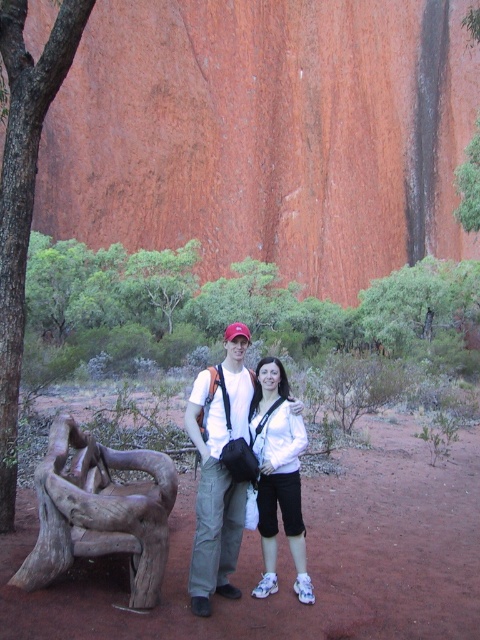
Question: Which is farther from the matte white shirt at center?

Choices:
 (A) smooth bark tree trunk at left
 (B) white matte shirt at center

Answer: (A)

Question: Observing the image, what is the correct spatial positioning of smooth bark tree trunk at left in reference to white matte shirt at center?

Choices:
 (A) below
 (B) above

Answer: (B)

Question: In this image, where is matte white shirt at center located relative to white matte shirt at center?

Choices:
 (A) above
 (B) below

Answer: (A)

Question: Which of the following is the farthest from the observer?

Choices:
 (A) smooth bark tree trunk at left
 (B) white matte shirt at center

Answer: (A)

Question: Is matte white shirt at center further to the viewer compared to white matte shirt at center?

Choices:
 (A) yes
 (B) no

Answer: (B)

Question: Which object is closer to the camera taking this photo?

Choices:
 (A) white matte shirt at center
 (B) smooth bark tree trunk at left

Answer: (A)